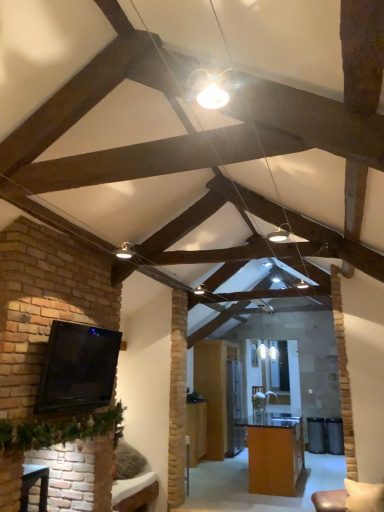
This screenshot has width=384, height=512. I want to click on matte white bulb at center, so click(x=211, y=87).

What is the approximate height of black glossy tv at left?

The height of black glossy tv at left is 27.82 inches.

This screenshot has width=384, height=512. Find the location of `orange glossy table at center, marked as the 2th table in a left-to-right arrangement`. orange glossy table at center, marked as the 2th table in a left-to-right arrangement is located at coordinates (274, 451).

This screenshot has width=384, height=512. Describe the element at coordinates (196, 430) in the screenshot. I see `wooden table at center, which is the first table from left to right` at that location.

The width and height of the screenshot is (384, 512). Find the location of `matte white bulb at center`. matte white bulb at center is located at coordinates (211, 87).

Between black glossy tv at left and wooden table at center, which ranks as the second table in right-to-left order, which one has larger width?

Wider between the two is wooden table at center, which ranks as the second table in right-to-left order.

I want to click on open to the left of wooden table at center, which is the first table from left to right, so click(x=77, y=369).

Is black glossy tv at left closer to camera compared to wooden table at center, which ranks as the second table in right-to-left order?

Yes, it is.

Considering the sizes of objects black glossy tv at left and wooden table at center, which ranks as the second table in right-to-left order, in the image provided, who is smaller, black glossy tv at left or wooden table at center, which ranks as the second table in right-to-left order,?

With smaller size is black glossy tv at left.

Who is smaller, matte white bulb at center or orange glossy table at center, marked as the 2th table in a left-to-right arrangement?

matte white bulb at center is smaller.

Which of these two, matte white bulb at center or orange glossy table at center, positioned as the 1th table in right-to-left order, stands taller?

orange glossy table at center, positioned as the 1th table in right-to-left order, is taller.

How distant is matte white bulb at center from orange glossy table at center, marked as the 2th table in a left-to-right arrangement?

The distance of matte white bulb at center from orange glossy table at center, marked as the 2th table in a left-to-right arrangement, is 5.03 meters.

From the image's perspective, is matte white bulb at center located above orange glossy table at center, positioned as the 1th table in right-to-left order?

Yes, from the image's perspective, matte white bulb at center is over orange glossy table at center, positioned as the 1th table in right-to-left order.

Which of these two, matte white bulb at center or black glossy tv at left, is smaller?

Smaller between the two is matte white bulb at center.

Image resolution: width=384 pixels, height=512 pixels. I want to click on light fixture above the black glossy tv at left (from the image's perspective), so click(211, 87).

How much distance is there between matte white bulb at center and black glossy tv at left?

matte white bulb at center is 2.35 meters away from black glossy tv at left.

Is matte white bulb at center not inside wooden table at center, which is the first table from left to right?

Yes.

From the image's perspective, would you say matte white bulb at center is positioned over wooden table at center, which is the first table from left to right?

Correct, matte white bulb at center appears higher than wooden table at center, which is the first table from left to right, in the image.

How far apart are matte white bulb at center and wooden table at center, which ranks as the second table in right-to-left order?

matte white bulb at center is 6.64 meters from wooden table at center, which ranks as the second table in right-to-left order.

From a real-world perspective, relative to wooden table at center, which is the first table from left to right, is matte white bulb at center vertically above or below?

Clearly, from a real-world perspective, matte white bulb at center is above wooden table at center, which is the first table from left to right.

Could brick fireplace at lower left be considered to be inside black glossy tv at left?

Definitely not — brick fireplace at lower left is not inside black glossy tv at left.

Based on their positions, is black glossy tv at left located to the left or right of brick fireplace at lower left?

Clearly, black glossy tv at left is on the right of brick fireplace at lower left in the image.

Who is smaller, black glossy tv at left or brick fireplace at lower left?

Smaller between the two is brick fireplace at lower left.

How different are the orientations of brick fireplace at lower left and wooden table at center, which is the first table from left to right, in degrees?

brick fireplace at lower left and wooden table at center, which is the first table from left to right, are facing 0.496 degrees away from each other.

Is brick fireplace at lower left smaller than wooden table at center, which is the first table from left to right?

Indeed, brick fireplace at lower left has a smaller size compared to wooden table at center, which is the first table from left to right.

Which table is the 2nd one when counting from the back of the brick fireplace at lower left? Please provide its 2D coordinates.

[(196, 430)]

In the image, is brick fireplace at lower left positioned in front of or behind wooden table at center, which ranks as the second table in right-to-left order?

Result: brick fireplace at lower left is in front of wooden table at center, which ranks as the second table in right-to-left order.

Is brick fireplace at lower left not inside black glossy tv at left?

Indeed, brick fireplace at lower left is completely outside black glossy tv at left.

Does brick fireplace at lower left have a larger size compared to black glossy tv at left?

Actually, brick fireplace at lower left might be smaller than black glossy tv at left.

Is brick fireplace at lower left far from black glossy tv at left?

brick fireplace at lower left is near black glossy tv at left, not far away.

What are the coordinates of `open lying above the wooden table at center, which is the first table from left to right (from the image's perspective)` in the screenshot? It's located at (77, 369).

This screenshot has width=384, height=512. There is a orange glossy table at center, positioned as the 1th table in right-to-left order. What are the coordinates of `light fixture above it (from a real-world perspective)` in the screenshot? It's located at (211, 87).

Estimate the real-world distances between objects in this image. Which object is closer to black glossy tv at left, wooden table at center, which is the first table from left to right, or matte white bulb at center?

matte white bulb at center is closer to black glossy tv at left.

Considering their positions, is matte white bulb at center positioned further to black glossy tv at left than wooden table at center, which ranks as the second table in right-to-left order?

The object further to black glossy tv at left is wooden table at center, which ranks as the second table in right-to-left order.

Estimate the real-world distances between objects in this image. Which object is closer to matte white bulb at center, wooden table at center, which ranks as the second table in right-to-left order, or orange glossy table at center, marked as the 2th table in a left-to-right arrangement?

The object closer to matte white bulb at center is orange glossy table at center, marked as the 2th table in a left-to-right arrangement.

When comparing their distances from brick fireplace at lower left, does orange glossy table at center, positioned as the 1th table in right-to-left order, or black glossy tv at left seem closer?

Among the two, black glossy tv at left is located nearer to brick fireplace at lower left.

Which object lies nearer to the anchor point orange glossy table at center, positioned as the 1th table in right-to-left order, black glossy tv at left or matte white bulb at center?

black glossy tv at left.

Estimate the real-world distances between objects in this image. Which object is closer to orange glossy table at center, marked as the 2th table in a left-to-right arrangement, brick fireplace at lower left or wooden table at center, which is the first table from left to right?

Among the two, wooden table at center, which is the first table from left to right, is located nearer to orange glossy table at center, marked as the 2th table in a left-to-right arrangement.

Which object lies further to the anchor point black glossy tv at left, orange glossy table at center, positioned as the 1th table in right-to-left order, or matte white bulb at center?

Among the two, orange glossy table at center, positioned as the 1th table in right-to-left order, is located further to black glossy tv at left.

When comparing their distances from wooden table at center, which is the first table from left to right, does matte white bulb at center or black glossy tv at left seem further?

Based on the image, matte white bulb at center appears to be further to wooden table at center, which is the first table from left to right.

Locate an element on the screen. open between matte white bulb at center and wooden table at center, which is the first table from left to right, in the front-back direction is located at coordinates (77, 369).

Locate an element on the screen. The image size is (384, 512). table between black glossy tv at left and wooden table at center, which ranks as the second table in right-to-left order, along the z-axis is located at coordinates (274, 451).

Image resolution: width=384 pixels, height=512 pixels. What are the coordinates of `table positioned between brick fireplace at lower left and wooden table at center, which is the first table from left to right, from near to far` in the screenshot? It's located at (274, 451).

The image size is (384, 512). Identify the location of furniture positioned between matte white bulb at center and orange glossy table at center, positioned as the 1th table in right-to-left order, from near to far. (33, 484).